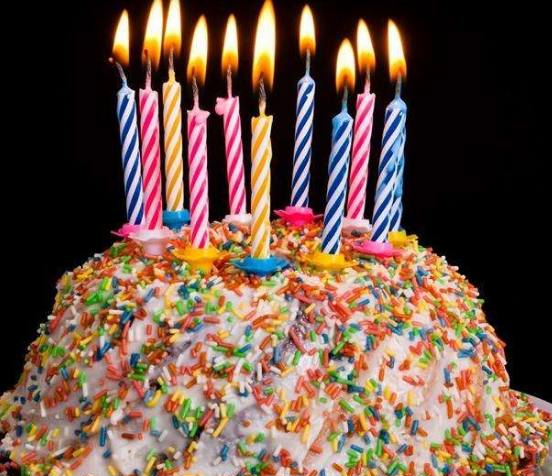
The width and height of the screenshot is (552, 476). I want to click on candle flames, so click(x=122, y=36), click(x=153, y=28), click(x=169, y=22), click(x=203, y=47), click(x=230, y=43), click(x=264, y=43), click(x=306, y=30), click(x=348, y=61), click(x=364, y=48), click(x=395, y=52).